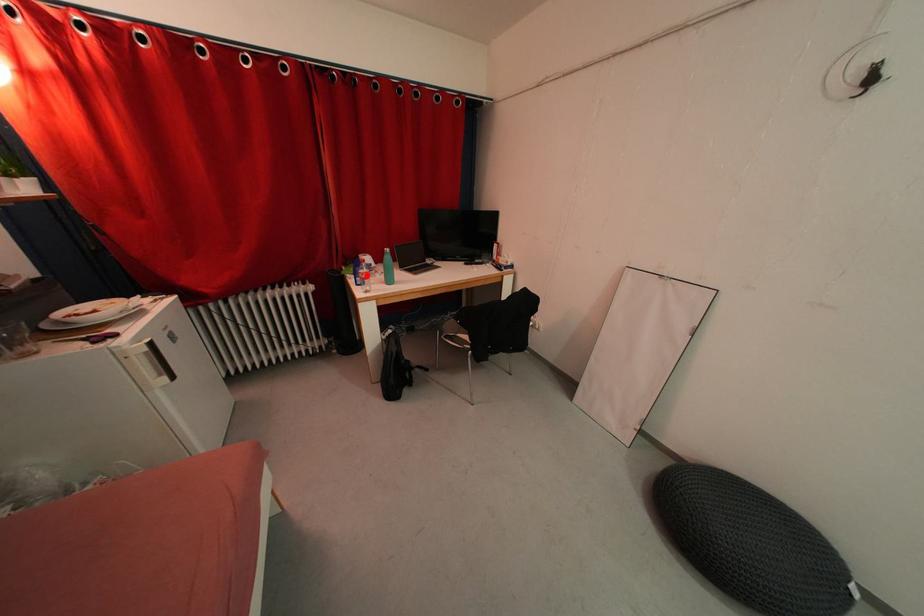
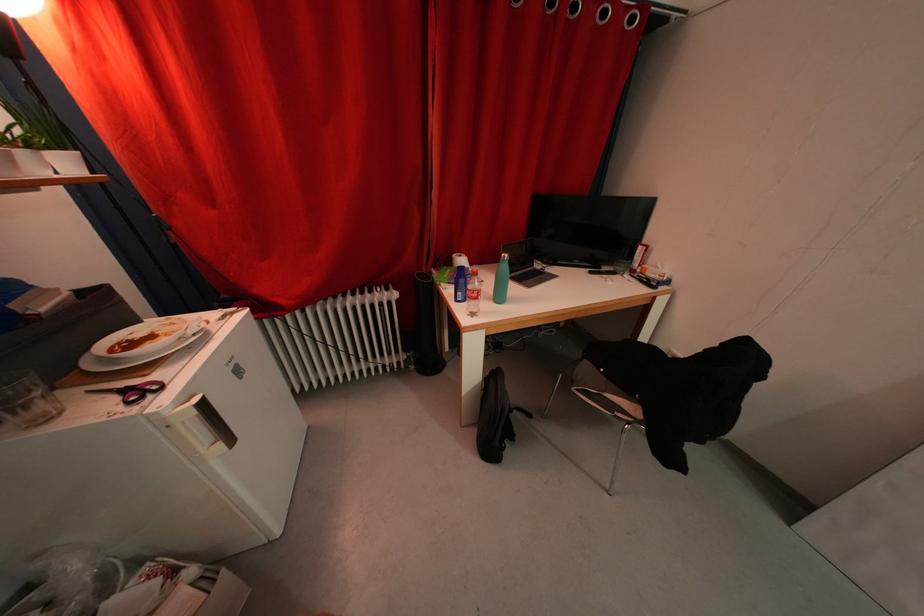
In the second image, find the point that corresponds to the highlighted location in the first image.

(476, 291)